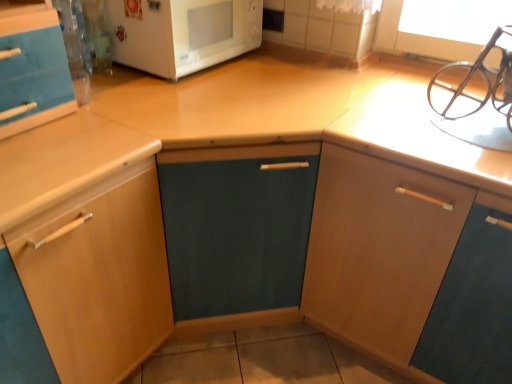
Question: From the image's perspective, is metallic silver sink at upper right located beneath wooden cabinet at left, positioned as the 1th cabinetry in left-to-right order?

Choices:
 (A) yes
 (B) no

Answer: (B)

Question: Is metallic silver sink at upper right far away from wooden cabinet at left, positioned as the 1th cabinetry in left-to-right order?

Choices:
 (A) no
 (B) yes

Answer: (A)

Question: From the image's perspective, is metallic silver sink at upper right located above wooden cabinet at left, positioned as the 1th cabinetry in left-to-right order?

Choices:
 (A) yes
 (B) no

Answer: (A)

Question: Is metallic silver sink at upper right not within wooden cabinet at left, the second cabinetry viewed from the right?

Choices:
 (A) no
 (B) yes

Answer: (B)

Question: Considering the relative positions of metallic silver sink at upper right and wooden cabinet at left, the second cabinetry viewed from the right, in the image provided, is metallic silver sink at upper right to the left of wooden cabinet at left, the second cabinetry viewed from the right, from the viewer's perspective?

Choices:
 (A) yes
 (B) no

Answer: (B)

Question: Is metallic silver sink at upper right thinner than wooden cabinet at left, the second cabinetry viewed from the right?

Choices:
 (A) no
 (B) yes

Answer: (B)

Question: Is white glossy microwave at upper center thinner than wooden cabinet at upper right, the 1th cabinetry viewed from the right?

Choices:
 (A) no
 (B) yes

Answer: (B)

Question: Does white glossy microwave at upper center have a greater width compared to wooden cabinet at upper right, the 1th cabinetry viewed from the right?

Choices:
 (A) yes
 (B) no

Answer: (B)

Question: Does white glossy microwave at upper center have a smaller size compared to wooden cabinet at upper right, which appears as the 2th cabinetry when viewed from the left?

Choices:
 (A) yes
 (B) no

Answer: (A)

Question: Does white glossy microwave at upper center have a lesser height compared to wooden cabinet at upper right, the 1th cabinetry viewed from the right?

Choices:
 (A) yes
 (B) no

Answer: (A)

Question: Does white glossy microwave at upper center appear on the left side of wooden cabinet at upper right, which appears as the 2th cabinetry when viewed from the left?

Choices:
 (A) no
 (B) yes

Answer: (B)

Question: Is wooden cabinet at upper right, the 1th cabinetry viewed from the right, surrounded by white glossy microwave at upper center?

Choices:
 (A) no
 (B) yes

Answer: (A)

Question: Is wooden cabinet at left, positioned as the 1th cabinetry in left-to-right order, touching white glossy microwave at upper center?

Choices:
 (A) no
 (B) yes

Answer: (A)